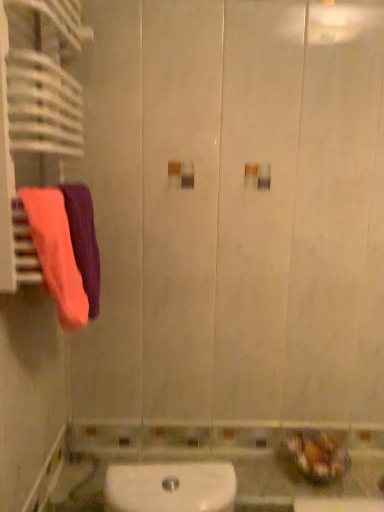
Question: Can you confirm if fluffy cotton towel at left, arranged as the first towel when viewed from the front, is positioned to the right of orange fabric towel at left, the second towel viewed from the front?

Choices:
 (A) no
 (B) yes

Answer: (A)

Question: From a real-world perspective, is fluffy cotton towel at left, arranged as the first towel when viewed from the front, beneath orange fabric towel at left, the second towel viewed from the front?

Choices:
 (A) no
 (B) yes

Answer: (A)

Question: Is fluffy cotton towel at left, arranged as the first towel when viewed from the front, not within orange fabric towel at left, arranged as the 1th towel when viewed from the back?

Choices:
 (A) yes
 (B) no

Answer: (B)

Question: Is fluffy cotton towel at left, which is counted as the second towel, starting from the back, looking in the opposite direction of orange fabric towel at left, arranged as the 1th towel when viewed from the back?

Choices:
 (A) yes
 (B) no

Answer: (B)

Question: Can you confirm if fluffy cotton towel at left, arranged as the first towel when viewed from the front, is thinner than orange fabric towel at left, the second towel viewed from the front?

Choices:
 (A) yes
 (B) no

Answer: (A)

Question: Would you consider fluffy cotton towel at left, arranged as the first towel when viewed from the front, to be distant from orange fabric towel at left, arranged as the 1th towel when viewed from the back?

Choices:
 (A) yes
 (B) no

Answer: (B)

Question: Does orange fabric towel at left, the second towel viewed from the front, have a lesser width compared to fluffy cotton towel at left, which is counted as the second towel, starting from the back?

Choices:
 (A) yes
 (B) no

Answer: (B)

Question: Would you say orange fabric towel at left, the second towel viewed from the front, is outside fluffy cotton towel at left, which is counted as the second towel, starting from the back?

Choices:
 (A) yes
 (B) no

Answer: (A)

Question: Does orange fabric towel at left, arranged as the 1th towel when viewed from the back, have a greater width compared to fluffy cotton towel at left, which is counted as the second towel, starting from the back?

Choices:
 (A) yes
 (B) no

Answer: (A)

Question: From the image's perspective, is orange fabric towel at left, the second towel viewed from the front, under fluffy cotton towel at left, arranged as the first towel when viewed from the front?

Choices:
 (A) yes
 (B) no

Answer: (B)

Question: Is orange fabric towel at left, the second towel viewed from the front, to the right of fluffy cotton towel at left, which is counted as the second towel, starting from the back, from the viewer's perspective?

Choices:
 (A) no
 (B) yes

Answer: (B)

Question: Is orange fabric towel at left, the second towel viewed from the front, taller than fluffy cotton towel at left, which is counted as the second towel, starting from the back?

Choices:
 (A) no
 (B) yes

Answer: (B)

Question: In the image, is orange fabric towel at left, arranged as the 1th towel when viewed from the back, on the left side or the right side of fluffy cotton towel at left, arranged as the first towel when viewed from the front?

Choices:
 (A) right
 (B) left

Answer: (A)